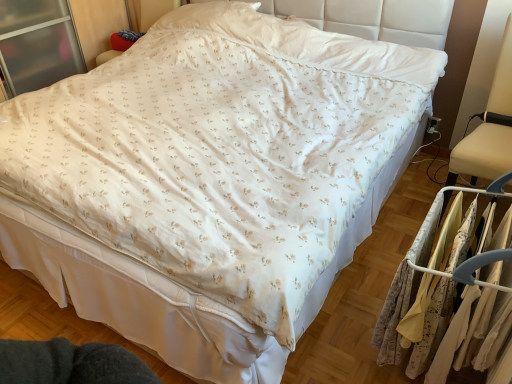
What do you see at coordinates (441, 290) in the screenshot? The width and height of the screenshot is (512, 384). I see `silky beige fabric at right` at bounding box center [441, 290].

This screenshot has width=512, height=384. Describe the element at coordinates (489, 127) in the screenshot. I see `beige fabric swivel chair at right` at that location.

This screenshot has width=512, height=384. I want to click on silky beige fabric at right, so click(441, 290).

From a real-world perspective, is silky beige fabric at right below beige fabric swivel chair at right?

Correct, in the physical world, silky beige fabric at right is lower than beige fabric swivel chair at right.

In terms of width, does silky beige fabric at right look wider or thinner when compared to beige fabric swivel chair at right?

In the image, silky beige fabric at right appears to be more narrow than beige fabric swivel chair at right.

From the image's perspective, does silky beige fabric at right appear higher than beige fabric swivel chair at right?

Actually, silky beige fabric at right appears below beige fabric swivel chair at right in the image.

Considering the positions of point (456, 153) and point (410, 253), is point (456, 153) closer or farther from the camera than point (410, 253)?

Clearly, point (456, 153) is more distant from the camera than point (410, 253).

Can you tell me how much beige fabric swivel chair at right and floral fabric dress at right differ in facing direction?

The facing directions of beige fabric swivel chair at right and floral fabric dress at right are 88 degrees apart.

Locate an element on the screen. The width and height of the screenshot is (512, 384). clothing located in front of the beige fabric swivel chair at right is located at coordinates (405, 289).

Can you confirm if beige fabric swivel chair at right is wider than floral fabric dress at right?

Yes, beige fabric swivel chair at right is wider than floral fabric dress at right.

Considering the sizes of silky beige fabric at right and floral fabric dress at right in the image, is silky beige fabric at right wider or thinner than floral fabric dress at right?

Considering their sizes, silky beige fabric at right looks broader than floral fabric dress at right.

Is silky beige fabric at right positioned in front of floral fabric dress at right?

Yes, it is.

Identify the location of closet above the floral fabric dress at right (from a real-world perspective). This screenshot has width=512, height=384. (441, 290).

Do you think silky beige fabric at right is within floral fabric dress at right, or outside of it?

The correct answer is: outside.

Is beige fabric swivel chair at right positioned behind silky beige fabric at right?

Yes, the depth of beige fabric swivel chair at right is greater than that of silky beige fabric at right.

From a real-world perspective, who is located higher, beige fabric swivel chair at right or silky beige fabric at right?

beige fabric swivel chair at right.

How distant is beige fabric swivel chair at right from silky beige fabric at right?

A distance of 16.84 inches exists between beige fabric swivel chair at right and silky beige fabric at right.

At what (x,y) coordinates should I click in order to perform the action: click on swivel chair behind the silky beige fabric at right. Please return your answer as a coordinate pair (x, y). The image size is (512, 384). Looking at the image, I should click on (489, 127).

Considering the positions of objects floral fabric dress at right and beige fabric swivel chair at right in the image provided, who is more to the right, floral fabric dress at right or beige fabric swivel chair at right?

From the viewer's perspective, beige fabric swivel chair at right appears more on the right side.

From a real-world perspective, who is located lower, floral fabric dress at right or beige fabric swivel chair at right?

floral fabric dress at right, from a real-world perspective.

Looking at this image, is floral fabric dress at right positioned behind beige fabric swivel chair at right?

No, it is not.

Are floral fabric dress at right and beige fabric swivel chair at right far apart?

That's not correct — floral fabric dress at right is a little close to beige fabric swivel chair at right.

Locate an element on the screen. clothing to the left of silky beige fabric at right is located at coordinates (405, 289).

Between floral fabric dress at right and silky beige fabric at right, which one has larger width?

With larger width is silky beige fabric at right.

How far apart are floral fabric dress at right and silky beige fabric at right?

The distance of floral fabric dress at right from silky beige fabric at right is 2.88 inches.

Would you say floral fabric dress at right is to the left or to the right of silky beige fabric at right in the picture?

floral fabric dress at right is positioned on silky beige fabric at right's left side.

In order to click on swivel chair above the silky beige fabric at right (from a real-world perspective) in this screenshot , I will do `click(489, 127)`.

The height and width of the screenshot is (384, 512). I want to click on clothing in front of the beige fabric swivel chair at right, so click(405, 289).

From the image, which object appears to be farther from beige fabric swivel chair at right, silky beige fabric at right or floral fabric dress at right?

floral fabric dress at right is positioned further to the anchor beige fabric swivel chair at right.

Looking at the image, which one is located closer to floral fabric dress at right, silky beige fabric at right or beige fabric swivel chair at right?

silky beige fabric at right lies closer to floral fabric dress at right than the other object.

From the image, which object appears to be nearer to floral fabric dress at right, beige fabric swivel chair at right or silky beige fabric at right?

silky beige fabric at right lies closer to floral fabric dress at right than the other object.

Based on their spatial positions, is floral fabric dress at right or beige fabric swivel chair at right further from silky beige fabric at right?

The object further to silky beige fabric at right is beige fabric swivel chair at right.

Looking at the image, which one is located further to beige fabric swivel chair at right, floral fabric dress at right or silky beige fabric at right?

Based on the image, floral fabric dress at right appears to be further to beige fabric swivel chair at right.

Based on their spatial positions, is beige fabric swivel chair at right or floral fabric dress at right further from silky beige fabric at right?

beige fabric swivel chair at right.

Where is `closet between beige fabric swivel chair at right and floral fabric dress at right from top to bottom`? This screenshot has width=512, height=384. closet between beige fabric swivel chair at right and floral fabric dress at right from top to bottom is located at coordinates (441, 290).